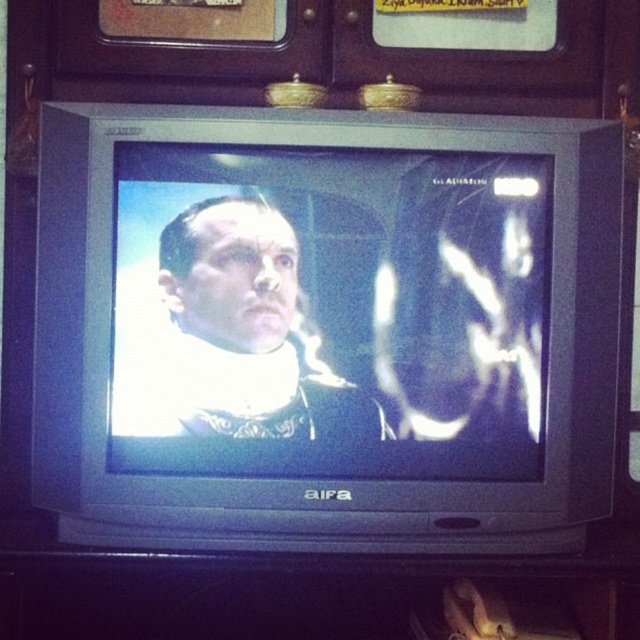
You are standing in front of a vintage CRT television set. There is a point at coordinates point (x=326, y=312). Which object is this point located on?

The point (x=326, y=312) is located on the matte black television at center.

You are an interior designer planning to place a new painting on the wall behind the matte black television at center and the matte black man at center. To ensure the painting will cover both objects equally, you need to know which object has a greater width. Which one is wider?

The matte black television at center is wider than the matte black man at center, so the painting should be placed to cover the wider television first.

You are standing in front of the vintage CRT television set and notice both the matte black television at center and the matte black man at center. Which object is nearer to you?

The matte black television at center is closer to the viewer than the matte black man at center.